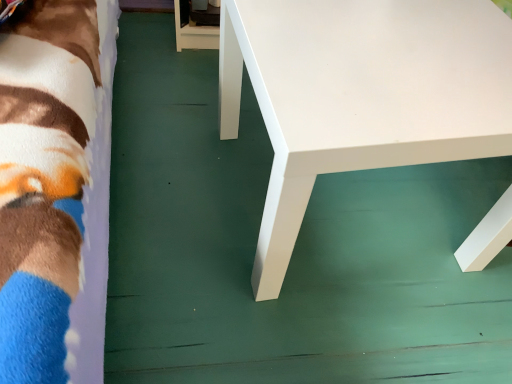
You are a GUI agent. You are given a task and a screenshot of the screen. Output one action in this format:
    pyautogui.click(x=<x>, y=<y>)
    Task: Click on the vacant space situated on the left part of white matte table at center
    The height and width of the screenshot is (384, 512).
    Given the screenshot: What is the action you would take?
    pyautogui.click(x=177, y=189)